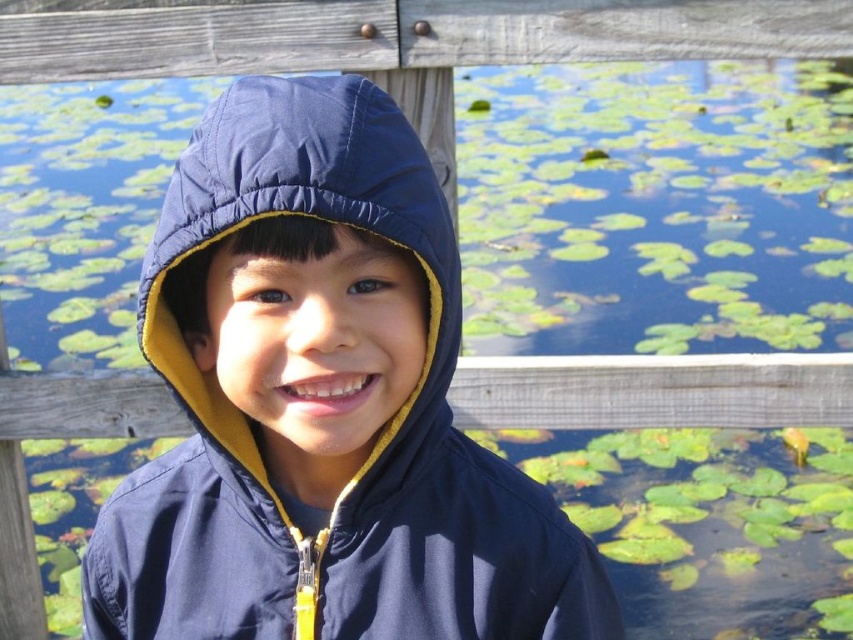
You are a fashion designer observing the child in the scene. You need to determine which item of clothing is bigger between the navy blue jacket at center and the navy blue quilted hood at center. Which one is larger?

The navy blue jacket at center is larger in size than the navy blue quilted hood at center according to the description.

The child is wearing a navy blue jacket at center and a navy blue quilted hood at center. Which one is wider?

The navy blue jacket at center is wider than the navy blue quilted hood at center.

You are a photographer standing at the camera position. You want to take a photo of the point at coordinate point (352, 102). Can you reach that point with your camera lens? The camera has a minimum focusing distance of 30 inches.

The distance between point (352, 102) and the camera is 35.88 inches, which is greater than the camera lens minimum focusing distance of 30 inches. Therefore, the camera can focus on the point at (352, 102).